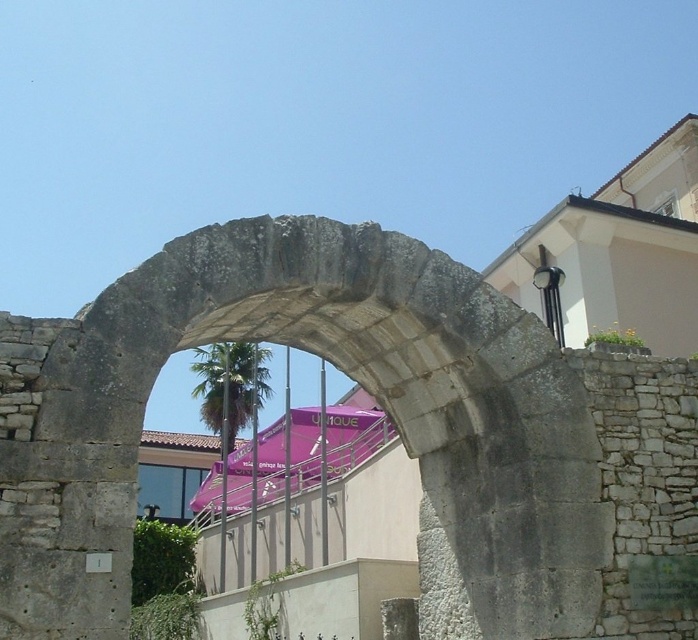
You are standing in front of the gray stone archway at center and the green leafy palm tree at center. Which object takes up more area in the image?

The green leafy palm tree at center takes up more area than the gray stone archway at center because the gray stone archway at center occupies less space than green leafy palm tree at center.

You are a delivery drone with a maximum flight range of 50 meters. You need to deliver a package from the gray stone archway at center to the green leafy palm tree at center. Can you complete the delivery without needing to recharge?

The gray stone archway at center and green leafy palm tree at center are 48.25 meters apart from each other. Since your drone has a maximum flight range of 50 meters, you can complete the delivery without needing to recharge.

You are standing in front of the image and want to locate the gray stone archway at center. What are its coordinates?

The gray stone archway at center is located at coordinates point (349, 376).